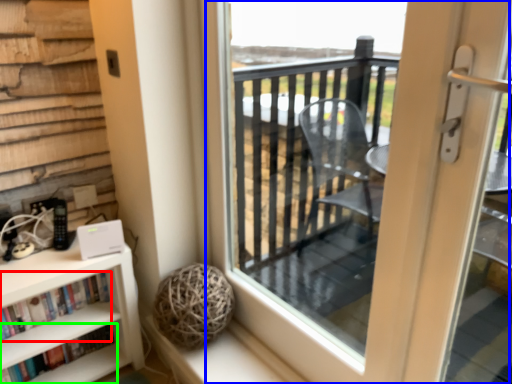
Question: Which is nearer to the book (highlighted by a red box)? screen door (highlighted by a blue box) or book (highlighted by a green box).

Choices:
 (A) screen door
 (B) book

Answer: (B)